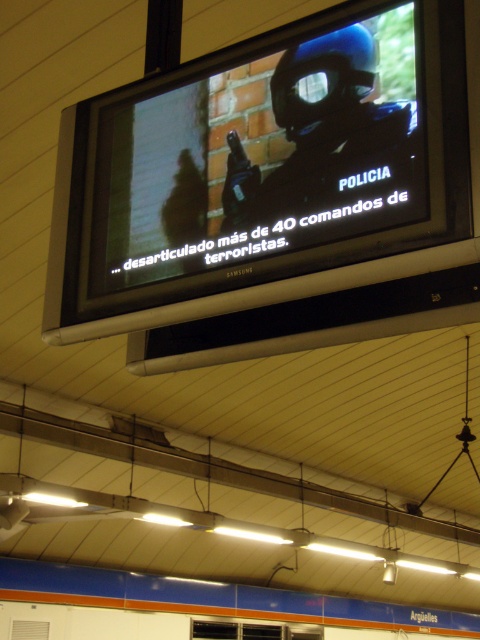
Question: Which point is closer to the camera?

Choices:
 (A) (398, 128)
 (B) (338, 138)

Answer: (A)

Question: Observing the image, what is the correct spatial positioning of matte black screen at upper center in reference to matte black helmet at center?

Choices:
 (A) left
 (B) right

Answer: (A)

Question: Which object is closer to the camera taking this photo?

Choices:
 (A) matte black screen at upper center
 (B) matte black helmet at center

Answer: (A)

Question: Is matte black screen at upper center behind matte black helmet at center?

Choices:
 (A) no
 (B) yes

Answer: (A)

Question: From the image, what is the correct spatial relationship of matte black screen at upper center in relation to matte black helmet at center?

Choices:
 (A) above
 (B) below

Answer: (B)

Question: Among these objects, which one is farthest from the camera?

Choices:
 (A) matte black helmet at center
 (B) matte black screen at upper center

Answer: (A)